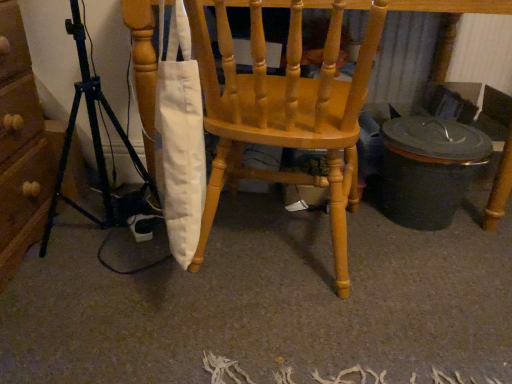
This screenshot has width=512, height=384. What do you see at coordinates (226, 131) in the screenshot? I see `matte wood chair at center` at bounding box center [226, 131].

Find the location of `matte wood chair at center`. matte wood chair at center is located at coordinates (226, 131).

Where is `black metal tripod at left`? This screenshot has height=384, width=512. black metal tripod at left is located at coordinates (96, 146).

What do you see at coordinates (96, 146) in the screenshot? I see `black metal tripod at left` at bounding box center [96, 146].

This screenshot has width=512, height=384. Find the location of `matte wood chair at center`. matte wood chair at center is located at coordinates (226, 131).

Is black metal tripod at left to the left or to the right of matte wood chair at center in the image?

In the image, black metal tripod at left appears on the left side of matte wood chair at center.

In the scene shown: Which object is further away from the camera taking this photo, black metal tripod at left or matte wood chair at center?

matte wood chair at center is behind.

Which is nearer, (80, 96) or (497, 179)?

Point (80, 96) is positioned closer to the camera compared to point (497, 179).

From the image's perspective, is black metal tripod at left under matte wood chair at center?

Yes, from the image's perspective, black metal tripod at left is beneath matte wood chair at center.

From a real-world perspective, is black metal tripod at left positioned above or below matte wood chair at center?

From a real-world perspective, black metal tripod at left is physically below matte wood chair at center.

Is black metal tripod at left wider than matte wood chair at center?

No, black metal tripod at left is not wider than matte wood chair at center.

In the scene shown: Which of these two, black metal tripod at left or matte wood chair at center, stands taller?

With more height is black metal tripod at left.

Considering the relative sizes of black metal tripod at left and matte wood chair at center in the image provided, is black metal tripod at left smaller than matte wood chair at center?

Indeed, black metal tripod at left has a smaller size compared to matte wood chair at center.

Is black metal tripod at left not inside matte wood chair at center?

That's correct, black metal tripod at left is outside of matte wood chair at center.

Does black metal tripod at left touch matte wood chair at center?

black metal tripod at left and matte wood chair at center are not in contact.

Could you tell me if black metal tripod at left is turned towards matte wood chair at center?

Yes, black metal tripod at left is facing matte wood chair at center.

This screenshot has height=384, width=512. In order to click on tripod that is under the matte wood chair at center (from a real-world perspective) in this screenshot , I will do `click(96, 146)`.

Looking at this image, considering the positions of objects matte wood chair at center and black metal tripod at left in the image provided, who is more to the left, matte wood chair at center or black metal tripod at left?

Positioned to the left is black metal tripod at left.

Which object is further away from the camera taking this photo, matte wood chair at center or black metal tripod at left?

matte wood chair at center is behind.

Considering the points (146, 119) and (90, 97), which point is behind, point (146, 119) or point (90, 97)?

Point (90, 97)

From the image's perspective, would you say matte wood chair at center is positioned over black metal tripod at left?

Correct, matte wood chair at center appears higher than black metal tripod at left in the image.

From a real-world perspective, which object rests below the other?

From a 3D spatial view, black metal tripod at left is below.

Considering the sizes of objects matte wood chair at center and black metal tripod at left in the image provided, who is wider, matte wood chair at center or black metal tripod at left?

With larger width is matte wood chair at center.

Can you confirm if matte wood chair at center is taller than black metal tripod at left?

Incorrect, the height of matte wood chair at center is not larger of that of black metal tripod at left.

Who is smaller, matte wood chair at center or black metal tripod at left?

black metal tripod at left.

Is black metal tripod at left completely or partially inside matte wood chair at center?

No, black metal tripod at left is not surrounded by matte wood chair at center.

Is matte wood chair at center placed right next to black metal tripod at left?

No, matte wood chair at center is not touching black metal tripod at left.

Is matte wood chair at center oriented towards black metal tripod at left?

No, matte wood chair at center is not aimed at black metal tripod at left.

Looking at this image, how different are the orientations of matte wood chair at center and black metal tripod at left in degrees?

The angle between the facing direction of matte wood chair at center and the facing direction of black metal tripod at left is 97 degrees.

Locate an element on the screen. The width and height of the screenshot is (512, 384). tripod below the matte wood chair at center (from a real-world perspective) is located at coordinates (96, 146).

Identify the location of chair above the black metal tripod at left (from the image's perspective). (226, 131).

The image size is (512, 384). I want to click on chair on the right of black metal tripod at left, so point(226,131).